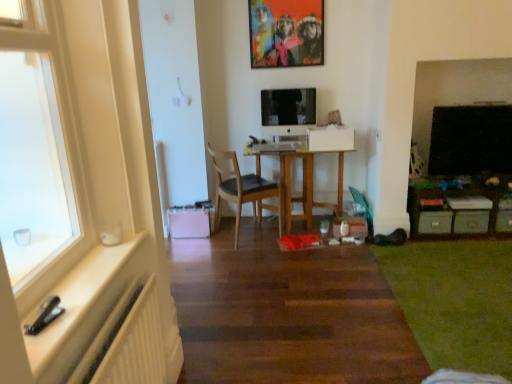
Question: Should I look upward or downward to see green matte drawer at lower right, which is the 1th drawer in right-to-left order?

Choices:
 (A) up
 (B) down

Answer: (B)

Question: Does wooden chair at center turn towards green matte drawer at lower right, placed as the second drawer when sorted from left to right?

Choices:
 (A) yes
 (B) no

Answer: (B)

Question: Is wooden chair at center to the right of green matte drawer at lower right, placed as the second drawer when sorted from left to right, from the viewer's perspective?

Choices:
 (A) no
 (B) yes

Answer: (A)

Question: Does wooden chair at center have a lesser height compared to green matte drawer at lower right, which is the 1th drawer in right-to-left order?

Choices:
 (A) no
 (B) yes

Answer: (A)

Question: Does wooden chair at center have a smaller size compared to green matte drawer at lower right, placed as the second drawer when sorted from left to right?

Choices:
 (A) yes
 (B) no

Answer: (B)

Question: Is wooden chair at center closer to camera compared to green matte drawer at lower right, placed as the second drawer when sorted from left to right?

Choices:
 (A) yes
 (B) no

Answer: (A)

Question: Are wooden chair at center and green matte drawer at lower right, which is the 1th drawer in right-to-left order, making contact?

Choices:
 (A) yes
 (B) no

Answer: (B)

Question: Are white glossy window sill at left and green matte drawer at lower right, placed as the second drawer when sorted from right to left, far apart?

Choices:
 (A) yes
 (B) no

Answer: (A)

Question: Can you confirm if white glossy window sill at left is bigger than green matte drawer at lower right, the first drawer from the left?

Choices:
 (A) yes
 (B) no

Answer: (A)

Question: Is white glossy window sill at left further to the viewer compared to green matte drawer at lower right, placed as the second drawer when sorted from right to left?

Choices:
 (A) no
 (B) yes

Answer: (A)

Question: Can you confirm if white glossy window sill at left is wider than green matte drawer at lower right, the first drawer from the left?

Choices:
 (A) yes
 (B) no

Answer: (A)

Question: Is white glossy window sill at left smaller than green matte drawer at lower right, the first drawer from the left?

Choices:
 (A) yes
 (B) no

Answer: (B)

Question: Is white glossy window sill at left positioned beyond the bounds of green matte drawer at lower right, placed as the second drawer when sorted from right to left?

Choices:
 (A) no
 (B) yes

Answer: (B)

Question: Is white ribbed radiator at lower left positioned far away from black glossy tv at right?

Choices:
 (A) no
 (B) yes

Answer: (B)